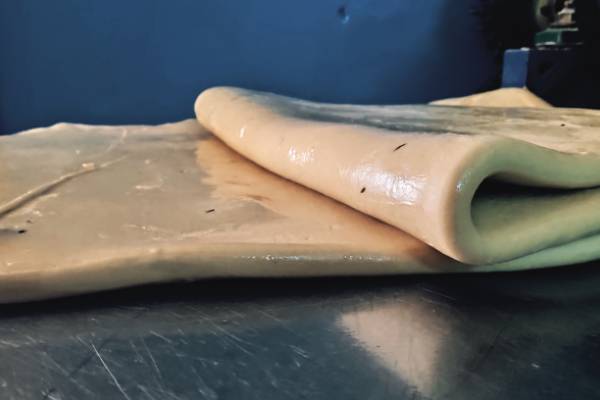
Image resolution: width=600 pixels, height=400 pixels. Identify the location of beige item on counter. (270, 228), (437, 157).